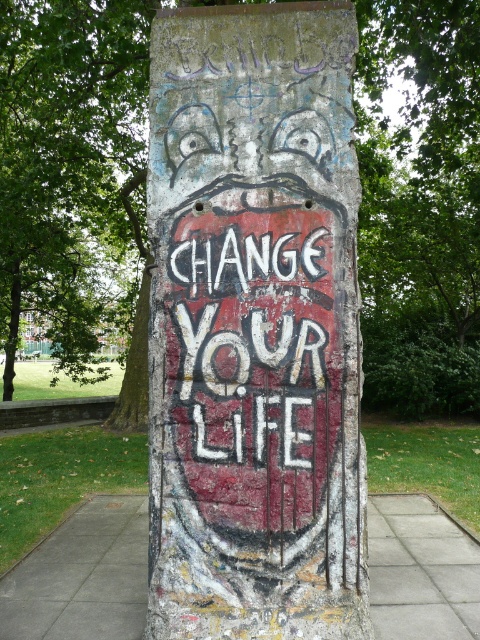
Question: Is grungy concrete pillar at center thinner than white chalk text at center?

Choices:
 (A) yes
 (B) no

Answer: (B)

Question: Does grungy concrete pillar at center appear on the left side of green leafy tree at center?

Choices:
 (A) yes
 (B) no

Answer: (A)

Question: Which of these objects is positioned closest to the grungy concrete pillar at center?

Choices:
 (A) white chalk text at center
 (B) green leafy tree at center
 (C) gray concrete pavement at center

Answer: (A)

Question: Estimate the real-world distances between objects in this image. Which object is closer to the grungy concrete pillar at center?

Choices:
 (A) green leafy tree at center
 (B) gray concrete pavement at center

Answer: (B)

Question: Is grungy concrete pillar at center wider than white chalk text at center?

Choices:
 (A) no
 (B) yes

Answer: (B)

Question: Among these points, which one is farthest from the camera?

Choices:
 (A) (276, 280)
 (B) (19, 586)

Answer: (B)